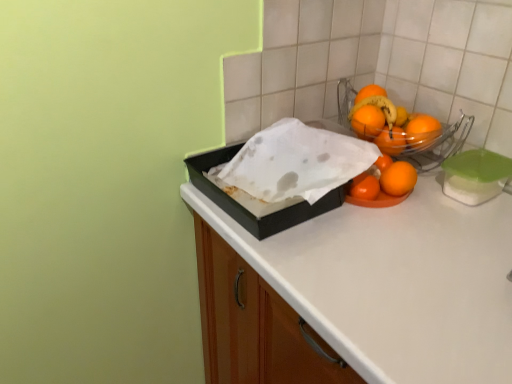
Question: Considering the relative sizes of orange matte/orange at center, the 1th orange from the bottom, and orange matte at right, arranged as the 3th orange when ordered from the bottom, in the image provided, is orange matte/orange at center, the 1th orange from the bottom, thinner than orange matte at right, arranged as the 3th orange when ordered from the bottom,?

Choices:
 (A) yes
 (B) no

Answer: (B)

Question: Would you say orange matte/orange at center, which appears as the 4th orange when viewed from the top, is outside orange matte at right, marked as the second orange in a top-to-bottom arrangement?

Choices:
 (A) no
 (B) yes

Answer: (B)

Question: From the image's perspective, is orange matte/orange at center, which appears as the 4th orange when viewed from the top, below orange matte at right, arranged as the 3th orange when ordered from the bottom?

Choices:
 (A) yes
 (B) no

Answer: (A)

Question: Can you confirm if orange matte/orange at center, which appears as the 4th orange when viewed from the top, is bigger than orange matte at right, arranged as the 3th orange when ordered from the bottom?

Choices:
 (A) yes
 (B) no

Answer: (A)

Question: Considering the relative sizes of orange matte/orange at center, which appears as the 4th orange when viewed from the top, and orange matte at right, marked as the second orange in a top-to-bottom arrangement, in the image provided, is orange matte/orange at center, which appears as the 4th orange when viewed from the top, taller than orange matte at right, marked as the second orange in a top-to-bottom arrangement,?

Choices:
 (A) yes
 (B) no

Answer: (A)

Question: From a real-world perspective, is orange matte/orange at center, the 1th orange from the bottom, located higher than orange matte at right, arranged as the 3th orange when ordered from the bottom?

Choices:
 (A) no
 (B) yes

Answer: (A)

Question: Is shiny orange oranges at upper right thinner than orange matte at upper right, the 4th orange positioned from the bottom?

Choices:
 (A) no
 (B) yes

Answer: (B)

Question: Is shiny orange oranges at upper right not close to orange matte at upper right, the 4th orange positioned from the bottom?

Choices:
 (A) yes
 (B) no

Answer: (B)

Question: Does shiny orange oranges at upper right come in front of orange matte at upper right, arranged as the first orange when viewed from the top?

Choices:
 (A) no
 (B) yes

Answer: (A)

Question: From the image's perspective, does shiny orange oranges at upper right appear lower than orange matte at upper right, the 4th orange positioned from the bottom?

Choices:
 (A) no
 (B) yes

Answer: (A)

Question: From the image's perspective, is shiny orange oranges at upper right over orange matte at upper right, arranged as the first orange when viewed from the top?

Choices:
 (A) no
 (B) yes

Answer: (B)

Question: From a real-world perspective, is shiny orange oranges at upper right on top of orange matte at upper right, arranged as the first orange when viewed from the top?

Choices:
 (A) yes
 (B) no

Answer: (A)

Question: Can you confirm if shiny orange oranges at upper right is bigger than black matte box at center?

Choices:
 (A) yes
 (B) no

Answer: (B)